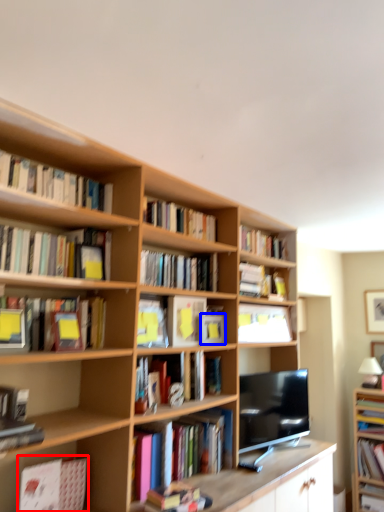
Question: Which of the following is the closest to the observer, book (highlighted by a red box) or paperback book (highlighted by a blue box)?

Choices:
 (A) book
 (B) paperback book

Answer: (A)